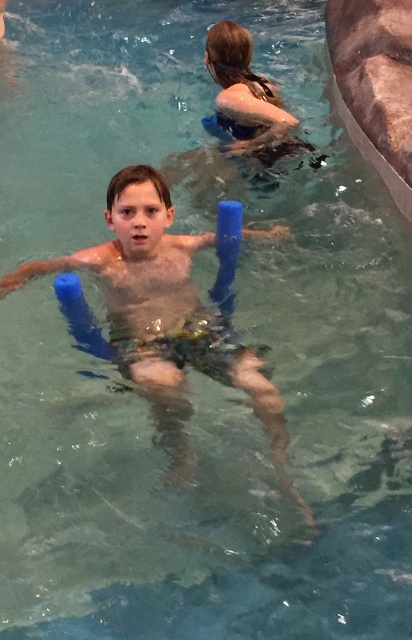
Consider the image. You are a lifeguard on duty and need to locate the blue foam floaties at center and the blue rubber float at upper center. From the perspective of someone looking at the pool from above, which object is positioned to the left?

The blue foam floaties at center are to the left of the blue rubber float at upper center, so the blue foam floaties at center are positioned to the left.

You are a lifeguard at the pool and need to determine which float is wider for a child who needs extra stability. Based on the scene, which float is wider between the blue foam floaties at center and the blue rubber float at upper center?

The blue foam floaties at center are wider than the blue rubber float at upper center, so they would provide more stability for the child.